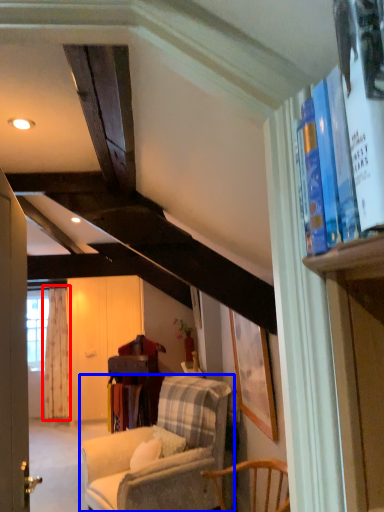
Question: Among these objects, which one is farthest to the camera, curtain (highlighted by a red box) or chair (highlighted by a blue box)?

Choices:
 (A) curtain
 (B) chair

Answer: (A)